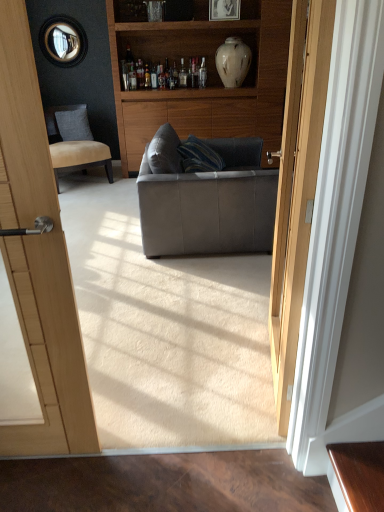
The height and width of the screenshot is (512, 384). What do you see at coordinates (208, 77) in the screenshot? I see `wooden cabinet at center` at bounding box center [208, 77].

What is the approximate width of suede tan chair at left?

It is 28.03 inches.

Locate an element on the screen. leather couch at center is located at coordinates (210, 204).

The image size is (384, 512). Identify the location of pillow behind the matte black picture frame at upper center. (74, 124).

Is matte black picture frame at upper center thinner than gray fabric pillow at left?

Yes, matte black picture frame at upper center is thinner than gray fabric pillow at left.

From a real-world perspective, does matte black picture frame at upper center stand above gray fabric pillow at left?

Indeed, from a real-world perspective, matte black picture frame at upper center stands above gray fabric pillow at left.

Are matte black picture frame at upper center and gray fabric pillow at left far apart?

matte black picture frame at upper center is positioned a significant distance from gray fabric pillow at left.

Is white glossy vase at upper center oriented towards gray fabric pillow at left?

No, white glossy vase at upper center is not turned towards gray fabric pillow at left.

Which object is positioned more to the left, white glossy vase at upper center or gray fabric pillow at left?

Positioned to the left is gray fabric pillow at left.

Is white glossy vase at upper center with gray fabric pillow at left?

white glossy vase at upper center and gray fabric pillow at left are not in contact.

Is white glossy vase at upper center taller or shorter than gray fabric pillow at left?

Considering their sizes, white glossy vase at upper center has more height than gray fabric pillow at left.

Based on the photo, considering the relative sizes of suede tan chair at left and matte black picture frame at upper center in the image provided, is suede tan chair at left smaller than matte black picture frame at upper center?

Incorrect, suede tan chair at left is not smaller in size than matte black picture frame at upper center.

Where is `picture frame lying behind the suede tan chair at left`? The image size is (384, 512). picture frame lying behind the suede tan chair at left is located at coordinates (224, 10).

Would you say suede tan chair at left is to the left or to the right of matte black picture frame at upper center in the picture?

From the image, it's evident that suede tan chair at left is to the left of matte black picture frame at upper center.

Between suede tan chair at left and matte black picture frame at upper center, which one is positioned in front?

Positioned in front is suede tan chair at left.

Is leather couch at center located within white glossy vase at upper center?

No, leather couch at center is located outside of white glossy vase at upper center.

Can you see white glossy vase at upper center touching leather couch at center?

No, white glossy vase at upper center is not with leather couch at center.

Does suede tan chair at left contain white glossy vase at upper center?

No, white glossy vase at upper center is not surrounded by suede tan chair at left.

In the image, is suede tan chair at left on the left side or the right side of white glossy vase at upper center?

Based on their positions, suede tan chair at left is located to the left of white glossy vase at upper center.

Relative to white glossy vase at upper center, is suede tan chair at left in front or behind?

Visually, suede tan chair at left is located in front of white glossy vase at upper center.

Is suede tan chair at left oriented away from white glossy vase at upper center?

suede tan chair at left is not turned away from white glossy vase at upper center.

Is point (252, 168) less distant than point (233, 41)?

Yes, point (252, 168) is closer to viewer.

Is leather couch at center surrounding white glossy vase at upper center?

No, leather couch at center does not contain white glossy vase at upper center.

How far apart are leather couch at center and white glossy vase at upper center?

leather couch at center and white glossy vase at upper center are 7.17 feet apart from each other.

In the image, is leather couch at center positioned in front of or behind white glossy vase at upper center?

Clearly, leather couch at center is in front of white glossy vase at upper center.

Which object is wider, wooden cabinet at center or matte black picture frame at upper center?

With larger width is wooden cabinet at center.

Based on their positions, is wooden cabinet at center located to the left or right of matte black picture frame at upper center?

wooden cabinet at center is to the left of matte black picture frame at upper center.

Would you say wooden cabinet at center is inside or outside matte black picture frame at upper center?

wooden cabinet at center lies outside matte black picture frame at upper center.

Locate an element on the screen. pillow located underneath the matte black picture frame at upper center (from a real-world perspective) is located at coordinates (74, 124).

Identify the location of pillow behind the white glossy vase at upper center. (74, 124).

Estimate the real-world distances between objects in this image. Which object is closer to white glossy vase at upper center, suede tan chair at left or gray fabric pillow at left?

suede tan chair at left.

When comparing their distances from matte black picture frame at upper center, does white glossy vase at upper center or wooden cabinet at center seem further?

wooden cabinet at center lies further to matte black picture frame at upper center than the other object.

Which object lies nearer to the anchor point wooden cabinet at center, leather couch at center or white glossy vase at upper center?

Based on the image, white glossy vase at upper center appears to be nearer to wooden cabinet at center.

Looking at the image, which one is located closer to leather couch at center, gray fabric pillow at left or white glossy vase at upper center?

white glossy vase at upper center lies closer to leather couch at center than the other object.

Considering their positions, is leather couch at center positioned closer to suede tan chair at left than matte black picture frame at upper center?

Among the two, leather couch at center is located nearer to suede tan chair at left.

Looking at the image, which one is located closer to leather couch at center, suede tan chair at left or matte black picture frame at upper center?

suede tan chair at left is positioned closer to the anchor leather couch at center.

Looking at the image, which one is located further to suede tan chair at left, white glossy vase at upper center or gray fabric pillow at left?

white glossy vase at upper center is further to suede tan chair at left.

From the image, which object appears to be farther from suede tan chair at left, leather couch at center or white glossy vase at upper center?

Based on the image, leather couch at center appears to be further to suede tan chair at left.

Where is `vase between leather couch at center and gray fabric pillow at left along the z-axis`? The width and height of the screenshot is (384, 512). vase between leather couch at center and gray fabric pillow at left along the z-axis is located at coordinates (233, 62).

Locate an element on the screen. cabinetry between suede tan chair at left and white glossy vase at upper center is located at coordinates (208, 77).

Find the location of a particular element. This screenshot has width=384, height=512. cabinetry that lies between matte black picture frame at upper center and leather couch at center from top to bottom is located at coordinates (208, 77).

The width and height of the screenshot is (384, 512). Find the location of `cabinetry between gray fabric pillow at left and white glossy vase at upper center in the horizontal direction`. cabinetry between gray fabric pillow at left and white glossy vase at upper center in the horizontal direction is located at coordinates (208, 77).